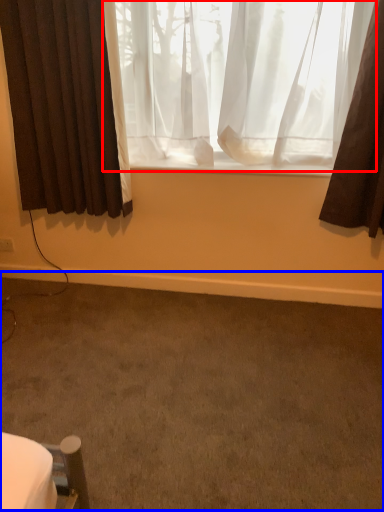
Question: Which point is further to the camera, curtain (highlighted by a red box) or plain (highlighted by a blue box)?

Choices:
 (A) curtain
 (B) plain

Answer: (A)